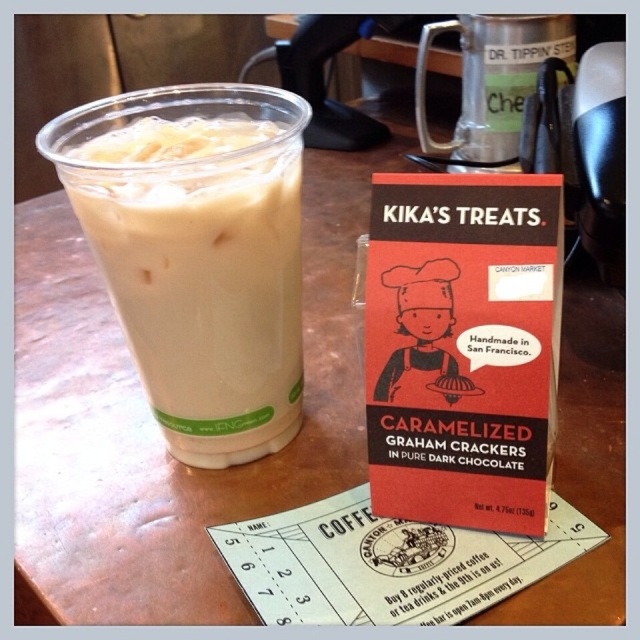
You are a barista working in the cafe and you need to place a new menu board on the wall behind the table. The menu board is 1 meter tall. You want to ensure that the menu board does not block the view of the white frothy milk at left and the metallic silver cup at upper center from the customer sitting at the table. Based on their positions, is the menu board likely to block the view of either item?

The white frothy milk at left is located below the metallic silver cup at upper center. Since the menu board is 1 meter tall, it might block the view of the metallic silver cup at upper center if placed directly behind it, but the white frothy milk at left, being lower, might still be visible depending on the board placement.

You are a barista arranging items on a table. You have the white frothy milk at left and the metallic silver cup at upper center. Which item is closer to you when viewed from the front of the table?

The white frothy milk at left is closer to you because it is in front of the metallic silver cup at upper center.

You are a barista preparing a latte and need to pour steamed milk into the cup. Given the sizes of the white frothy milk at left and the metallic silver cup at upper center, will the milk fit into the cup without spilling?

The white frothy milk at left is smaller than the metallic silver cup at upper center, so the milk will fit into the cup without spilling.